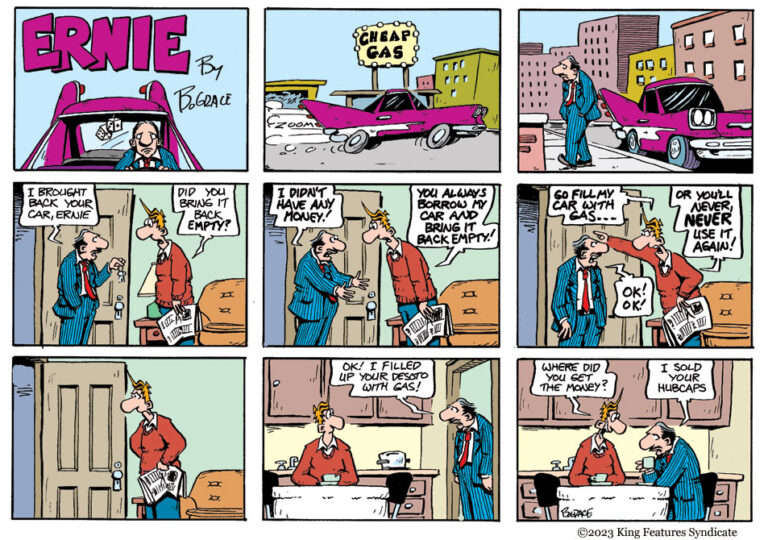
Where is `newspaper`? The height and width of the screenshot is (540, 768). newspaper is located at coordinates (171, 327), (159, 489), (418, 327), (694, 320).